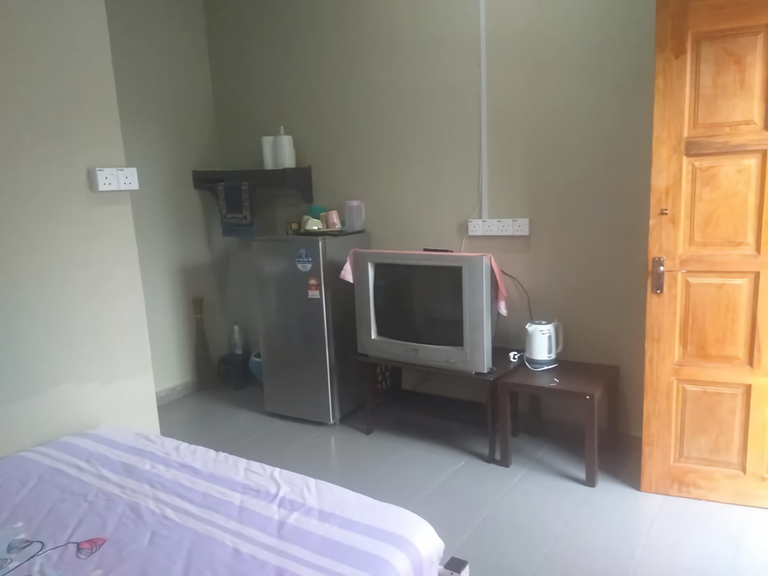
Identify the location of brown accent tables. (365, 384), (498, 403).